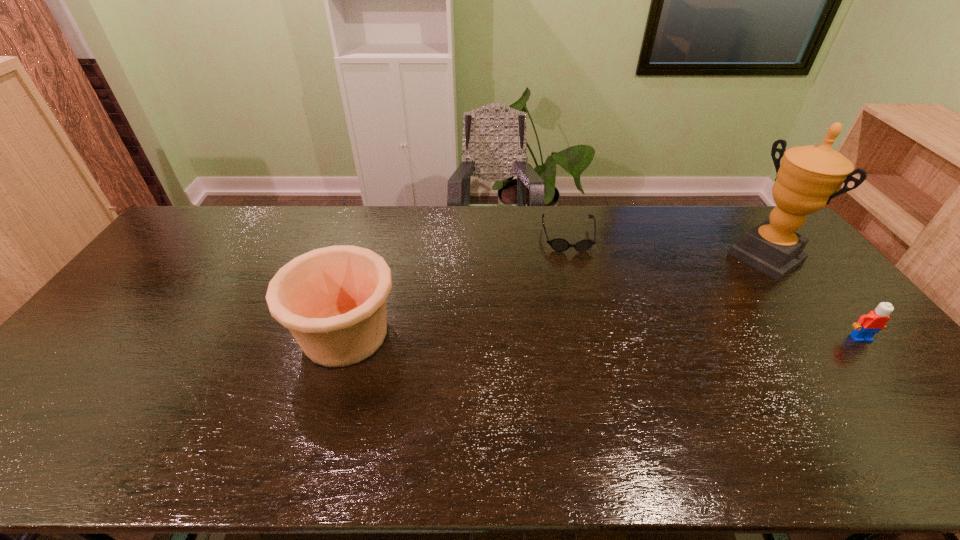
Locate an element on the screen. free space located 0.050m at the front of the award with handles is located at coordinates (737, 277).

Identify the location of free space located on the lenses of the second object from left to right. The height and width of the screenshot is (540, 960). [x=579, y=291].

You are a GUI agent. You are given a task and a screenshot of the screen. Output one action in this format:
    pyautogui.click(x=<x>, y=<y>)
    Task: Click on the blank space located on the lenses of the second object from left to right
    
    Given the screenshot: What is the action you would take?
    pyautogui.click(x=575, y=274)

At what (x,y) coordinates should I click in order to perform the action: click on blank space located on the lenses of the second object from left to right. Please return your answer as a coordinate pair (x, y). Looking at the image, I should click on click(x=580, y=293).

Where is `award at the far edge`? award at the far edge is located at coordinates (809, 177).

I want to click on sunglasses positioned at the far edge, so click(558, 244).

At what (x,y) coordinates should I click in order to perform the action: click on Lego that is at the right edge. Please return your answer as a coordinate pair (x, y). The image size is (960, 540). Looking at the image, I should click on (868, 325).

The height and width of the screenshot is (540, 960). I want to click on award that is at the right edge, so click(809, 177).

In order to click on object that is at the far right corner in this screenshot , I will do `click(809, 177)`.

You are a GUI agent. You are given a task and a screenshot of the screen. Output one action in this format:
    pyautogui.click(x=<x>, y=<y>)
    Task: Click on the free location at the far edge
    
    Given the screenshot: What is the action you would take?
    pyautogui.click(x=583, y=229)